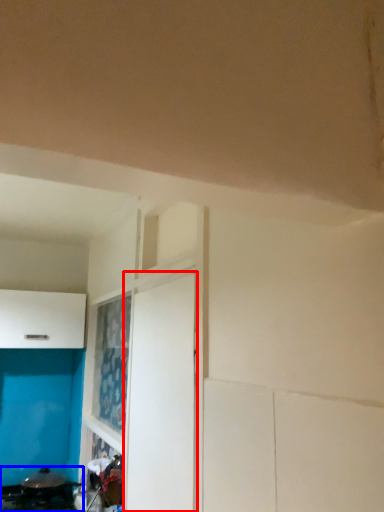
Question: Which object is closer to the camera taking this photo, door (highlighted by a red box) or appliance (highlighted by a blue box)?

Choices:
 (A) door
 (B) appliance

Answer: (A)